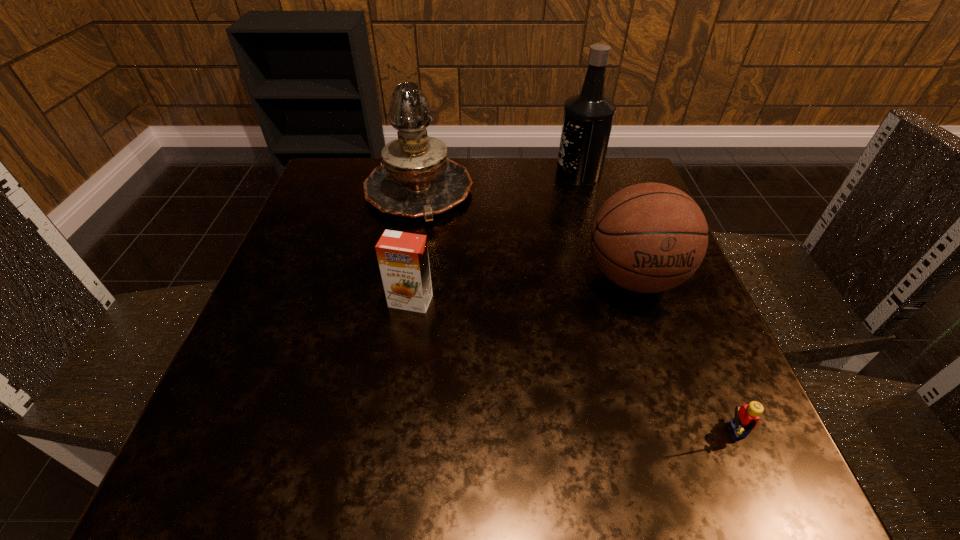
At what (x,y) coordinates should I click in order to perform the action: click on free spot located 0.150m on the side with brand label of the basketball. Please return your answer as a coordinate pair (x, y). Looking at the image, I should click on (674, 392).

I want to click on free space located on the right of the orange juice, so click(570, 301).

Find the location of a particular element. The width and height of the screenshot is (960, 540). free spot located on the front-facing side of the shortest object is located at coordinates (669, 431).

Where is `free space located 0.390m on the front-facing side of the shortest object`? This screenshot has width=960, height=540. free space located 0.390m on the front-facing side of the shortest object is located at coordinates (430, 431).

Where is `free spot located on the front-facing side of the shortest object`? The image size is (960, 540). free spot located on the front-facing side of the shortest object is located at coordinates (437, 431).

I want to click on liquor that is at the far edge, so click(588, 117).

You are a GUI agent. You are given a task and a screenshot of the screen. Output one action in this format:
    pyautogui.click(x=<x>, y=<y>)
    Task: Click on the oil lamp at the far edge
    The image size is (960, 540).
    Given the screenshot: What is the action you would take?
    pyautogui.click(x=416, y=179)

I want to click on object that is at the near edge, so click(x=746, y=418).

Where is `object at the left edge`? object at the left edge is located at coordinates (416, 179).

This screenshot has height=540, width=960. Find the location of `liquor present at the right edge`. liquor present at the right edge is located at coordinates (588, 117).